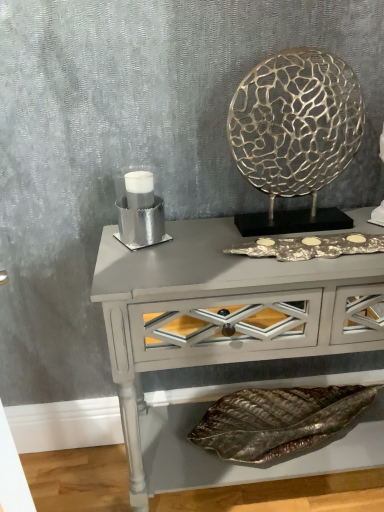
Locate an element on the screen. vacant region to the left of gold textured metal at upper right is located at coordinates (198, 243).